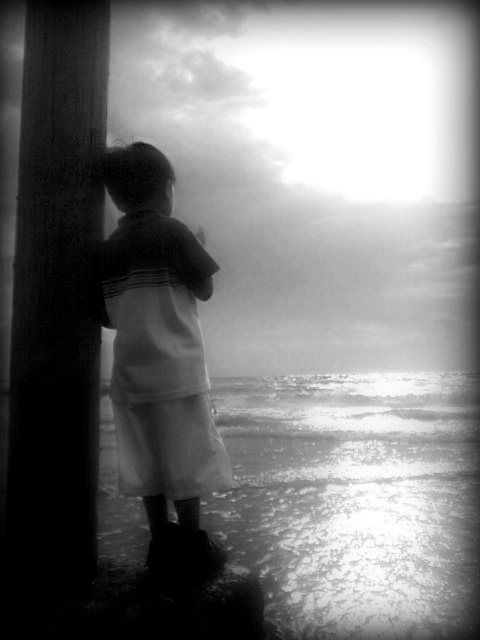
You are a photographer trying to capture the child in the image. To ensure the child is centered in your photo, where should you position the camera relative to the reflective wet sand at lower center?

To center the child in the photo, position the camera so that the reflective wet sand at lower center is located at point (354, 499) on the frame.

You are a photographer planning to take a picture of the reflective wet sand at lower center and the smooth wood post at left. You want to ensure both are in focus. If your camera has a depth of field that can cover 5 meters, will both objects be in focus?

The distance between reflective wet sand at lower center and smooth wood post at left is 5.11 meters. Since the camera can only cover 5 meters, the objects will not both be in focus.

You are a photographer analyzing the composition of this black and white photo. The scene includes a reflective wet sand at lower center and a white cotton shirt at left. Which object occupies a wider area in the frame?

The reflective wet sand at lower center occupies a wider area in the frame than the white cotton shirt at left.